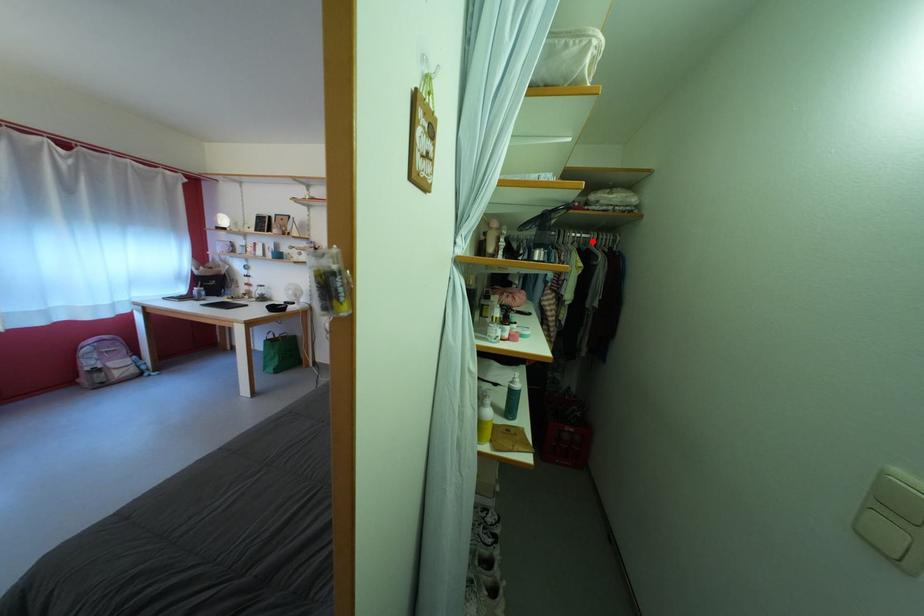
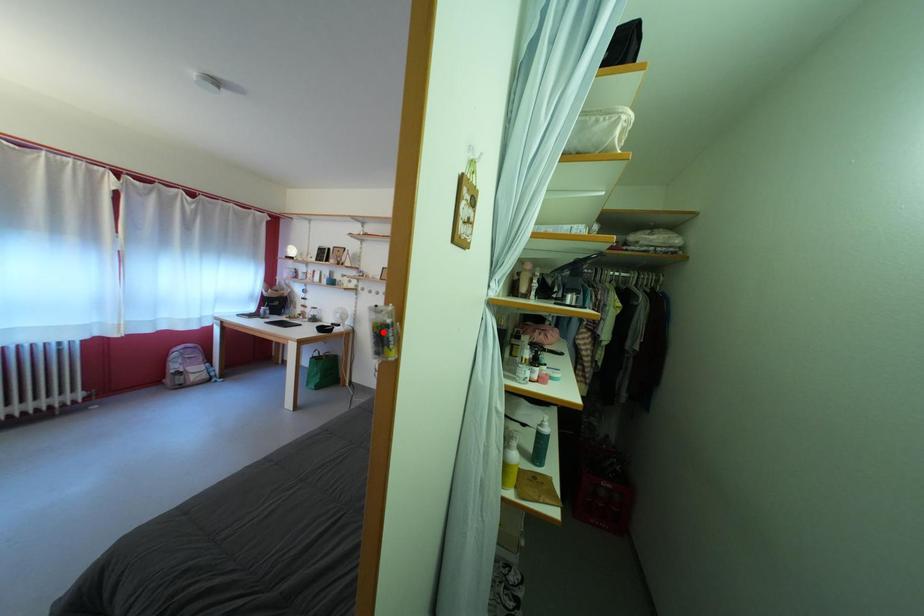
I am providing you with two images of the same scene from different viewpoints. A red point is marked on the first image and another point is marked on the second image. Do the highlighted points in image1 and image2 indicate the same real-world spot?

No